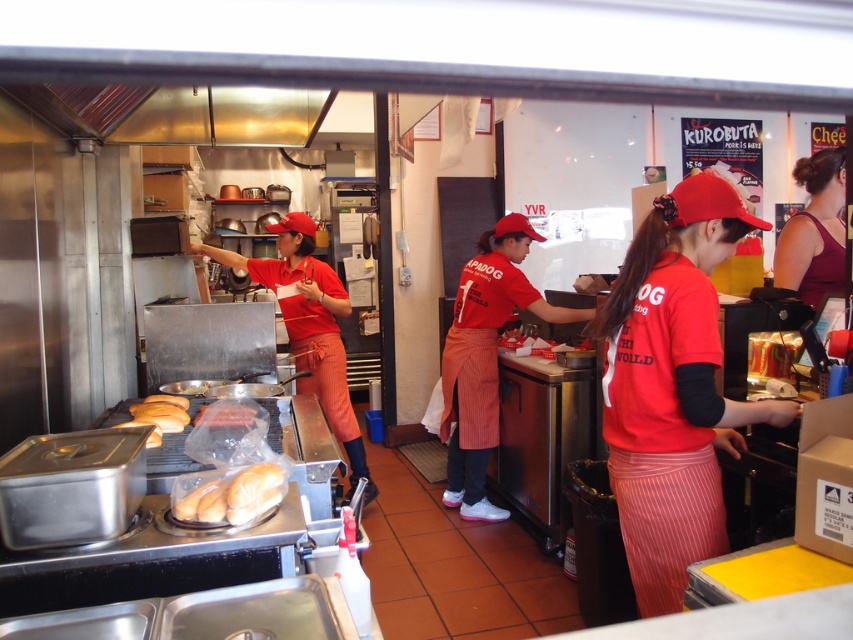
Which is behind, point (700, 472) or point (325, 324)?

The point (325, 324) is more distant.

Is point (657, 531) farther from viewer compared to point (309, 256)?

That is False.

Who is more distant from viewer, (712, 404) or (335, 356)?

Positioned behind is point (335, 356).

Locate an element on the screen. This screenshot has height=640, width=853. matte red cap at center is located at coordinates (672, 387).

Between point (189, 508) and point (196, 490), which one is positioned in front?

Point (189, 508) is more forward.

Can you confirm if translucent plastic baguette at center is positioned above white matte bread at lower left?

Yes.

The width and height of the screenshot is (853, 640). Describe the element at coordinates (230, 493) in the screenshot. I see `translucent plastic baguette at center` at that location.

Where is `translucent plastic baguette at center`? This screenshot has height=640, width=853. translucent plastic baguette at center is located at coordinates (230, 493).

Who is shorter, matte red cap at center or dark red fabric dress at right?

With less height is dark red fabric dress at right.

Who is lower down, matte red cap at center or dark red fabric dress at right?

matte red cap at center is below.

Who is more forward, (737, 211) or (839, 253)?

Point (737, 211)

Where is `matte red cap at center`? Image resolution: width=853 pixels, height=640 pixels. matte red cap at center is located at coordinates (672, 387).